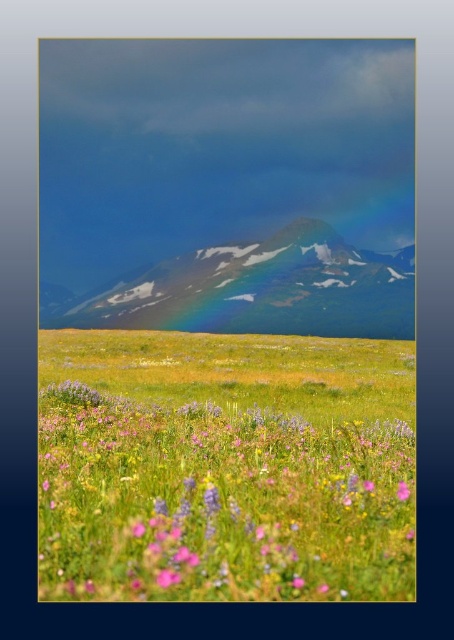
What are the coordinates of `soft pink petals at center` in the screenshot? It's located at (218, 502).

Who is more distant from viewer, (310,547) or (159,288)?

The point (159,288) is behind.

Does soft pink petals at center appear on the right side of sleek glassy mountain at center?

No, soft pink petals at center is not to the right of sleek glassy mountain at center.

Who is more forward, (153, 490) or (267, 291)?

Point (153, 490)

Locate an element on the screen. soft pink petals at center is located at coordinates (218, 502).

Looking at this image, is sleek glassy mountain at center closer to the viewer compared to pink matte flower at lower right?

No, sleek glassy mountain at center is further to the viewer.

Consider the image. Between sleek glassy mountain at center and pink matte flower at lower right, which one is positioned higher?

sleek glassy mountain at center is higher up.

Where is `sleek glassy mountain at center`? sleek glassy mountain at center is located at coordinates (261, 289).

This screenshot has height=640, width=454. I want to click on sleek glassy mountain at center, so click(261, 289).